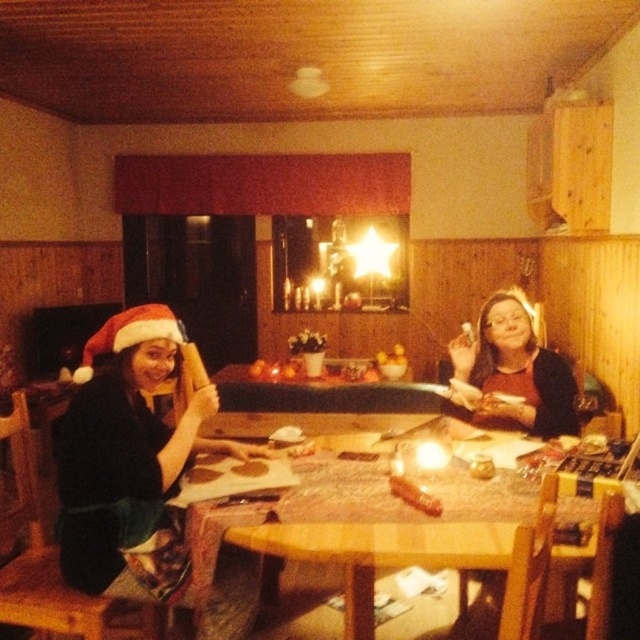
Question: Which object is farther from the camera taking this photo?

Choices:
 (A) matte black sweater at center
 (B) wooden table at center
 (C) matte black santa hat at left

Answer: (A)

Question: Is wooden table at center further to the viewer compared to matte black sweater at center?

Choices:
 (A) no
 (B) yes

Answer: (A)

Question: Which object is farther from the camera taking this photo?

Choices:
 (A) matte black sweater at center
 (B) matte black santa hat at left

Answer: (A)

Question: Based on their relative distances, which object is farther from the wooden table at center?

Choices:
 (A) matte black sweater at center
 (B) matte black santa hat at left

Answer: (A)

Question: Is matte black santa hat at left thinner than wooden table at center?

Choices:
 (A) no
 (B) yes

Answer: (B)

Question: Is matte black santa hat at left bigger than matte black sweater at center?

Choices:
 (A) no
 (B) yes

Answer: (B)